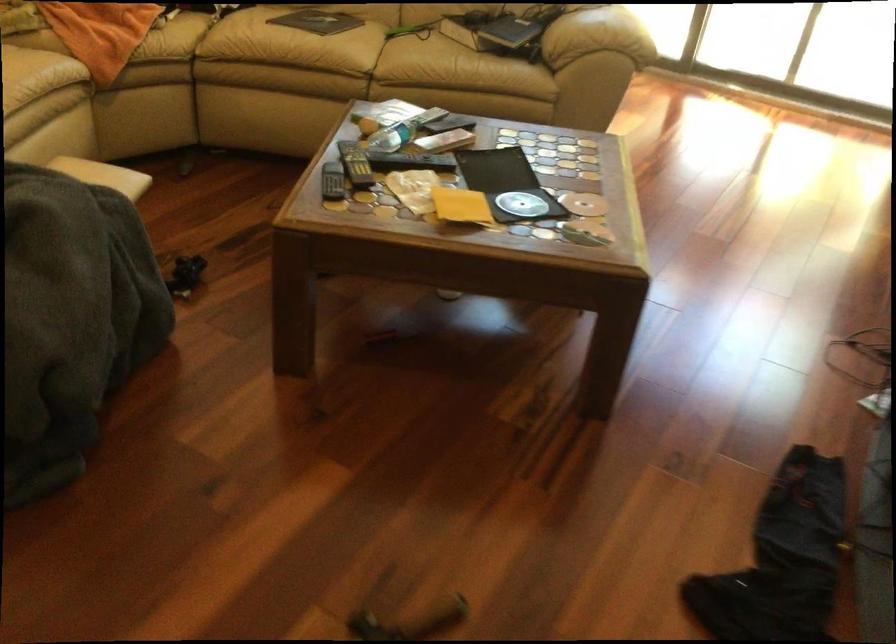
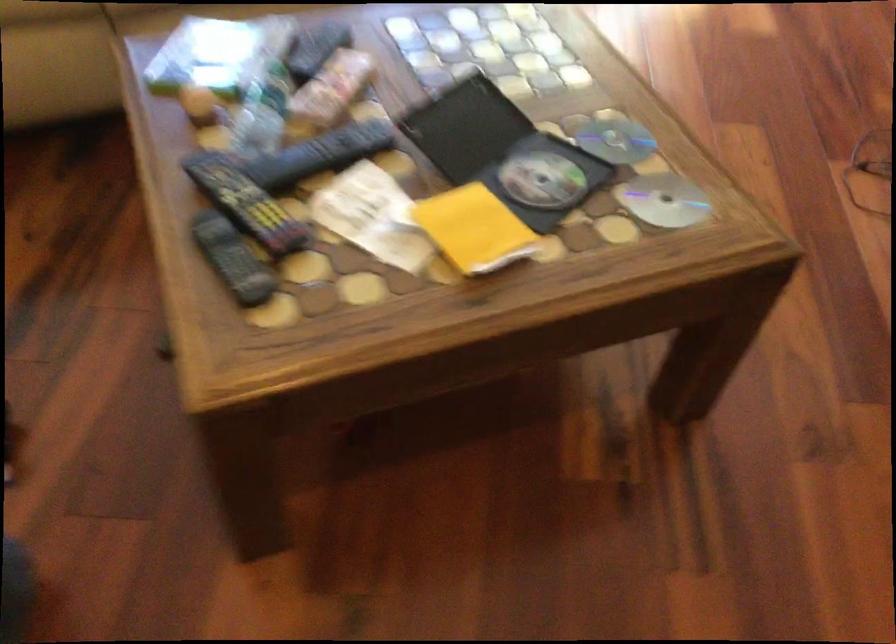
In the second image, find the point that corresponds to [458,203] in the first image.

(474, 229)